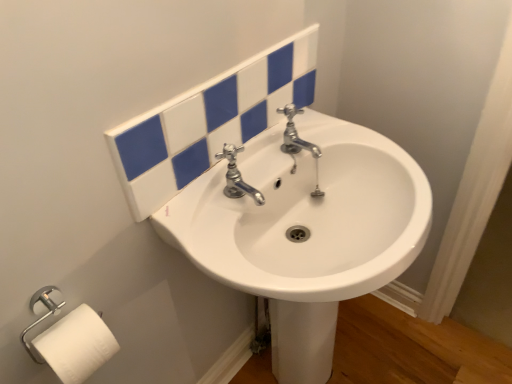
Question: Is white glossy sink at center bigger or smaller than white matte toilet paper at lower left?

Choices:
 (A) small
 (B) big

Answer: (B)

Question: Do you think white glossy sink at center is within white matte toilet paper at lower left, or outside of it?

Choices:
 (A) outside
 (B) inside

Answer: (A)

Question: Estimate the real-world distances between objects in this image. Which object is farther from the white matte toilet paper at lower left?

Choices:
 (A) white glossy sink at center
 (B) polished chrome faucet at center

Answer: (A)

Question: Which object is positioned closest to the white matte toilet paper at lower left?

Choices:
 (A) polished chrome faucet at center
 (B) white glossy sink at center

Answer: (A)